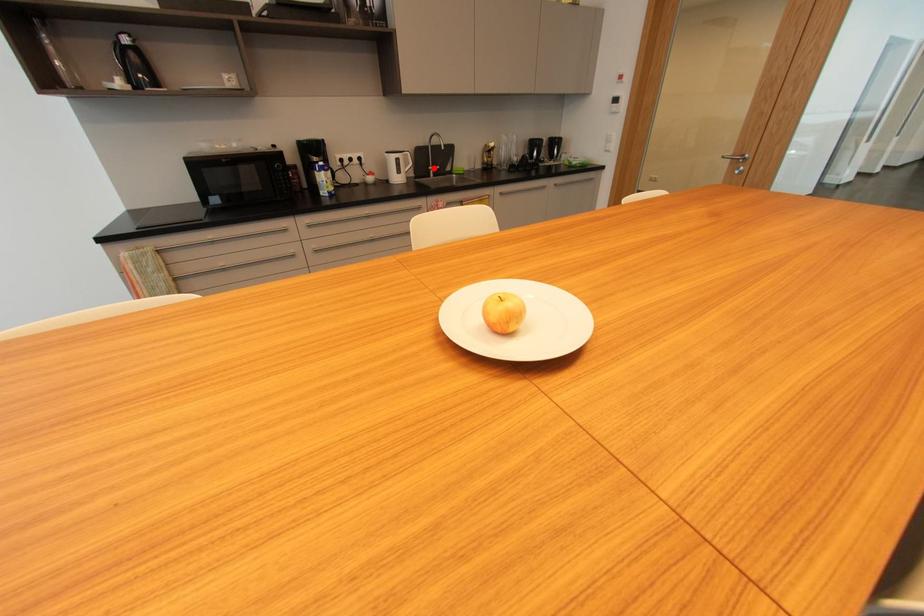
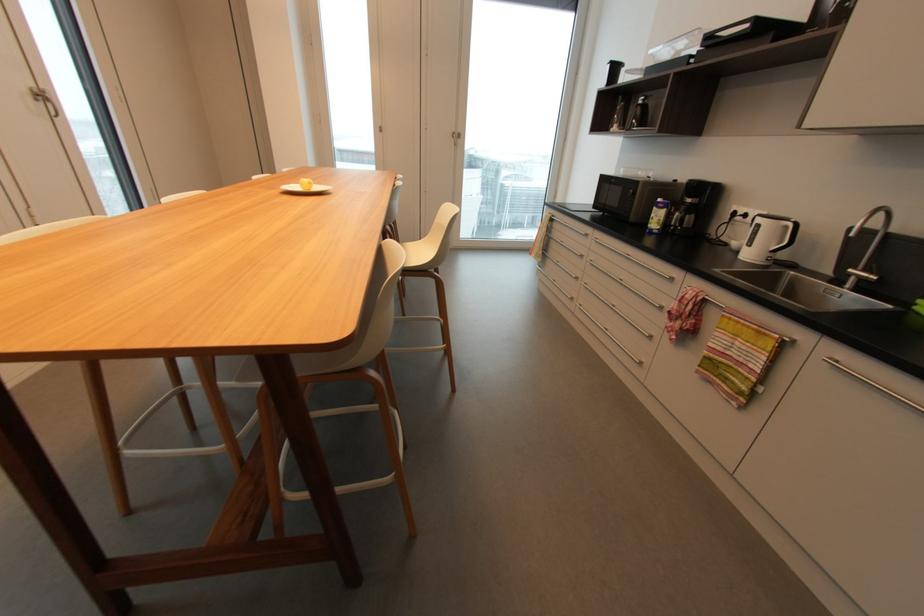
Question: I am providing you with two images of the same scene from different viewpoints. A red point is shown in image1. For the corresponding object point in image2, is it positioned nearer or farther from the camera?

Choices:
 (A) Nearer
 (B) Farther

Answer: (B)